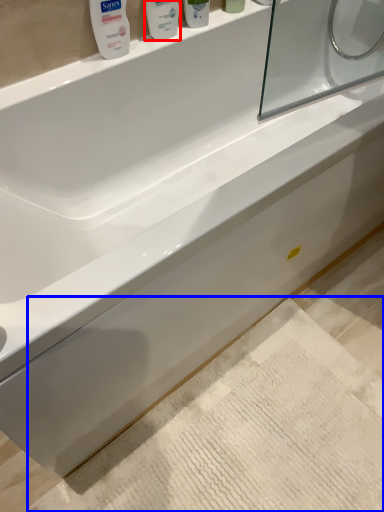
Question: Which object is further to the camera taking this photo, mouthwash (highlighted by a red box) or bath mat (highlighted by a blue box)?

Choices:
 (A) mouthwash
 (B) bath mat

Answer: (A)